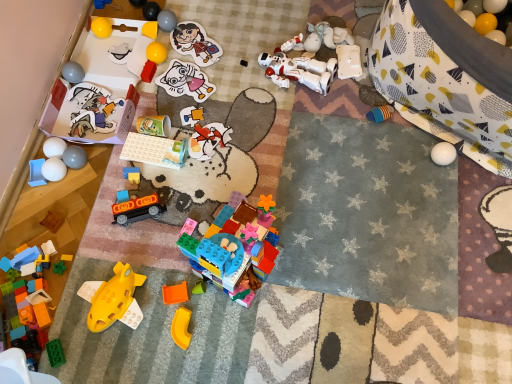
Locate an element on the screen. Image resolution: width=512 pixels, height=384 pixels. free space to the back side of translucent orange plastic toy at center, placed as the 22th toy when sorted from left to right is located at coordinates (180, 230).